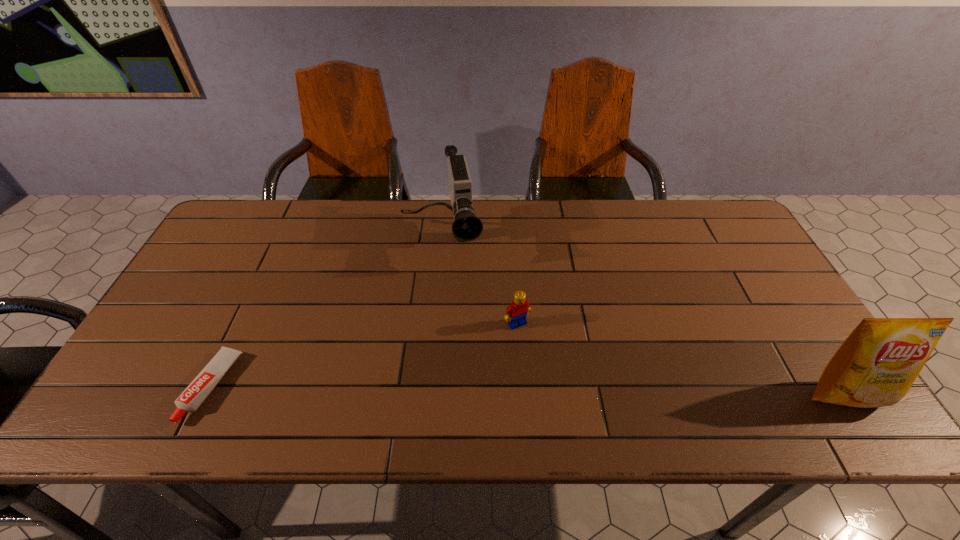
At what (x,y) coordinates should I click in order to perform the action: click on free space located 0.270m on the recording direction of the third object from right to left. Please return your answer as a coordinate pair (x, y). This screenshot has height=540, width=960. Looking at the image, I should click on (457, 350).

At what (x,y) coordinates should I click in order to perform the action: click on blank space located 0.150m on the front-facing side of the second object from right to left. Please return your answer as a coordinate pair (x, y). Looking at the image, I should click on (555, 376).

Identify the location of free location located 0.150m on the front-facing side of the second object from right to left. (555, 376).

Locate an element on the screen. vacant space positioned on the front-facing side of the second object from right to left is located at coordinates (543, 360).

The width and height of the screenshot is (960, 540). Identify the location of object situated at the far edge. (467, 226).

Locate an element on the screen. toothpaste that is positioned at the near edge is located at coordinates click(192, 397).

The image size is (960, 540). What are the coordinates of `crisp (potato chip) at the near edge` in the screenshot? It's located at (876, 365).

Find the location of a particular element. object that is positioned at the left edge is located at coordinates (192, 397).

Where is `object present at the right edge`? The image size is (960, 540). object present at the right edge is located at coordinates (876, 365).

Locate an element on the screen. The height and width of the screenshot is (540, 960). object positioned at the near left corner is located at coordinates (192, 397).